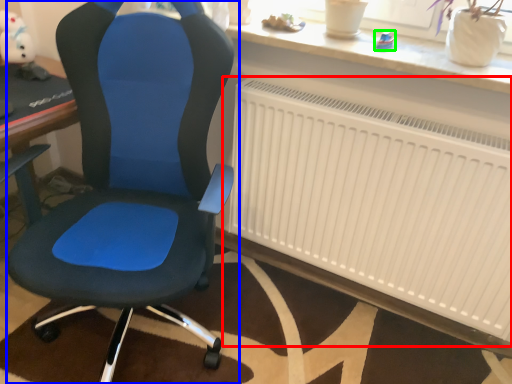
Question: Which object is the closest to the radiator (highlighted by a red box)? Choose among these: chair (highlighted by a blue box) or toy (highlighted by a green box).

Choices:
 (A) chair
 (B) toy

Answer: (A)